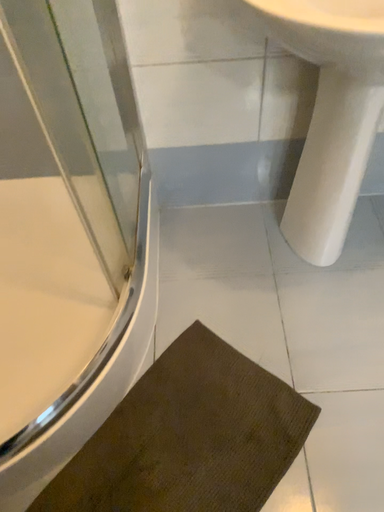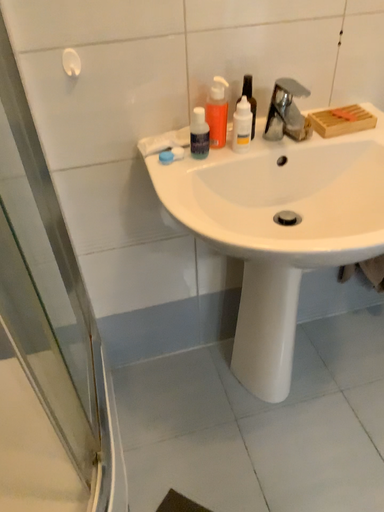
Question: Which way did the camera rotate in the video?

Choices:
 (A) rotated left
 (B) rotated right

Answer: (B)